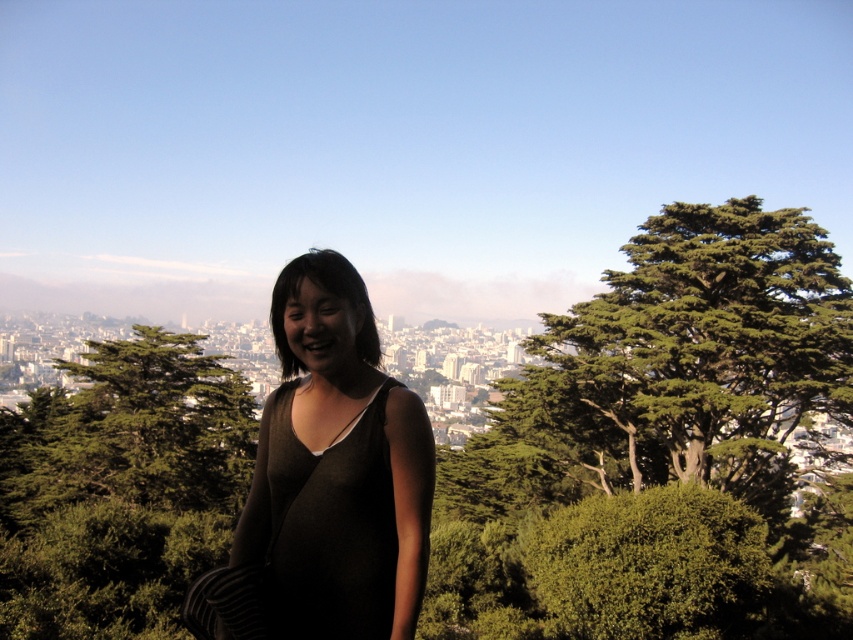
Question: Can you confirm if green leafy tree at center is positioned to the right of matte black dress at center?

Choices:
 (A) yes
 (B) no

Answer: (B)

Question: Is green leafy tree at center smaller than matte black dress at center?

Choices:
 (A) yes
 (B) no

Answer: (B)

Question: Can you confirm if green leafy tree at center is thinner than matte black dress at center?

Choices:
 (A) no
 (B) yes

Answer: (A)

Question: Which of the following is the farthest from the observer?

Choices:
 (A) (276, 486)
 (B) (231, 426)

Answer: (B)

Question: Which of the following is the farthest from the observer?

Choices:
 (A) (340, 513)
 (B) (242, 378)

Answer: (B)